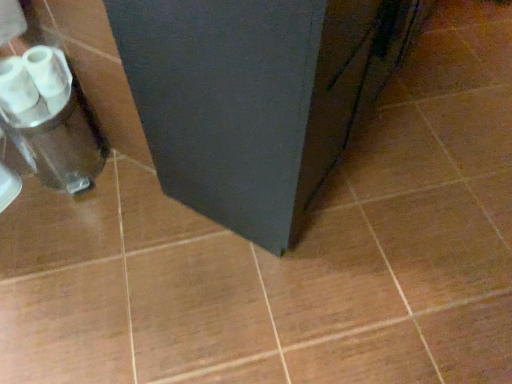
I want to click on silver metallic blender at left, so click(50, 119).

What is the approximate height of matte black cabinet at center?

29.59 inches.

At what (x,y) coordinates should I click in order to perform the action: click on silver metallic blender at left. Please return your answer as a coordinate pair (x, y). Looking at the image, I should click on (50, 119).

From a real-world perspective, who is located higher, silver metallic blender at left or white glossy toilet paper at left?

white glossy toilet paper at left is physically above.

What's the angular difference between silver metallic blender at left and white glossy toilet paper at left's facing directions?

The angular difference between silver metallic blender at left and white glossy toilet paper at left is 0.00128 degrees.

Could you tell me if silver metallic blender at left is facing white glossy toilet paper at left?

No, silver metallic blender at left is not turned towards white glossy toilet paper at left.

From the image's perspective, who appears lower, silver metallic blender at left or white glossy toilet paper at left?

silver metallic blender at left, from the image's perspective.

Considering the sizes of matte black cabinet at center and silver metallic blender at left in the image, is matte black cabinet at center wider or thinner than silver metallic blender at left?

matte black cabinet at center is wider than silver metallic blender at left.

Which object is closer to the camera taking this photo, matte black cabinet at center or silver metallic blender at left?

matte black cabinet at center is more forward.

Does matte black cabinet at center turn towards silver metallic blender at left?

No.

Are matte black cabinet at center and silver metallic blender at left located far from each other?

No, matte black cabinet at center is not far from silver metallic blender at left.

From a real-world perspective, is white glossy toilet paper at left physically located above or below matte black cabinet at center?

From a real-world perspective, white glossy toilet paper at left is physically below matte black cabinet at center.

In the image, there is a white glossy toilet paper at left. At what (x,y) coordinates should I click in order to perform the action: click on furniture above it (from the image's perspective). Please return your answer as a coordinate pair (x, y). The image size is (512, 384). Looking at the image, I should click on (256, 96).

Is white glossy toilet paper at left placed right next to matte black cabinet at center?

There is a gap between white glossy toilet paper at left and matte black cabinet at center.

Which object is wider, white glossy toilet paper at left or matte black cabinet at center?

matte black cabinet at center.

From a real-world perspective, is silver metallic blender at left located higher than matte black cabinet at center?

No.

Could matte black cabinet at center be considered to be inside silver metallic blender at left?

Definitely not — matte black cabinet at center is not inside silver metallic blender at left.

Is silver metallic blender at left to the right of matte black cabinet at center from the viewer's perspective?

No.

Looking at the image, does matte black cabinet at center seem bigger or smaller compared to white glossy toilet paper at left?

Clearly, matte black cabinet at center is larger in size than white glossy toilet paper at left.

How many degrees apart are the facing directions of matte black cabinet at center and white glossy toilet paper at left?

90 degrees separate the facing orientations of matte black cabinet at center and white glossy toilet paper at left.

From the image's perspective, is matte black cabinet at center on white glossy toilet paper at left?

Yes.

You are a GUI agent. You are given a task and a screenshot of the screen. Output one action in this format:
    pyautogui.click(x=<x>, y=<y>)
    Task: Click on the toilet paper below the matte black cabinet at center (from the image's perspective)
    This screenshot has height=384, width=512.
    Given the screenshot: What is the action you would take?
    pyautogui.click(x=34, y=82)

Is silver metallic blender at left at the back of white glossy toilet paper at left?

That's not correct — white glossy toilet paper at left is not looking away from silver metallic blender at left.

Can you see white glossy toilet paper at left touching silver metallic blender at left?

No, white glossy toilet paper at left is not beside silver metallic blender at left.

Is white glossy toilet paper at left at the right side of silver metallic blender at left?

In fact, white glossy toilet paper at left is to the left of silver metallic blender at left.

Is point (20, 98) behind point (32, 107)?

No, (20, 98) is closer to viewer.

Identify the location of toilet paper on the left of the silver metallic blender at left. The width and height of the screenshot is (512, 384). (34, 82).

I want to click on furniture above the silver metallic blender at left (from a real-world perspective), so click(x=256, y=96).

Consider the image. Based on their spatial positions, is white glossy toilet paper at left or matte black cabinet at center further from silver metallic blender at left?

matte black cabinet at center is positioned further to the anchor silver metallic blender at left.

From the image, which object appears to be nearer to matte black cabinet at center, silver metallic blender at left or white glossy toilet paper at left?

silver metallic blender at left is positioned closer to the anchor matte black cabinet at center.

Considering their positions, is matte black cabinet at center positioned further to silver metallic blender at left than white glossy toilet paper at left?

matte black cabinet at center is positioned further to the anchor silver metallic blender at left.

Considering their positions, is matte black cabinet at center positioned closer to white glossy toilet paper at left than silver metallic blender at left?

silver metallic blender at left is positioned closer to the anchor white glossy toilet paper at left.

From the image, which object appears to be nearer to matte black cabinet at center, white glossy toilet paper at left or silver metallic blender at left?

silver metallic blender at left lies closer to matte black cabinet at center than the other object.

From the image, which object appears to be nearer to white glossy toilet paper at left, silver metallic blender at left or matte black cabinet at center?

silver metallic blender at left is closer to white glossy toilet paper at left.

Locate an element on the screen. This screenshot has height=384, width=512. blender located between white glossy toilet paper at left and matte black cabinet at center in the left-right direction is located at coordinates (50, 119).